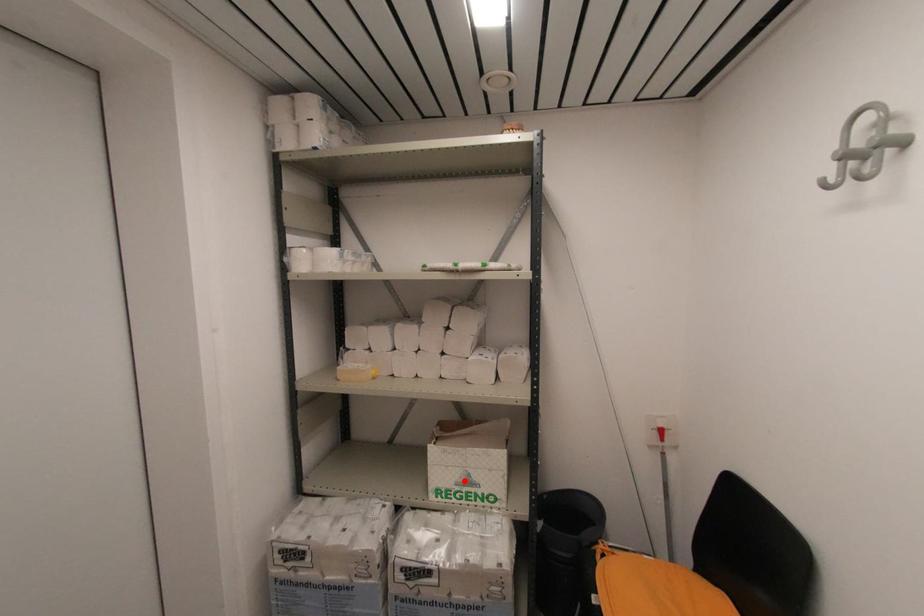
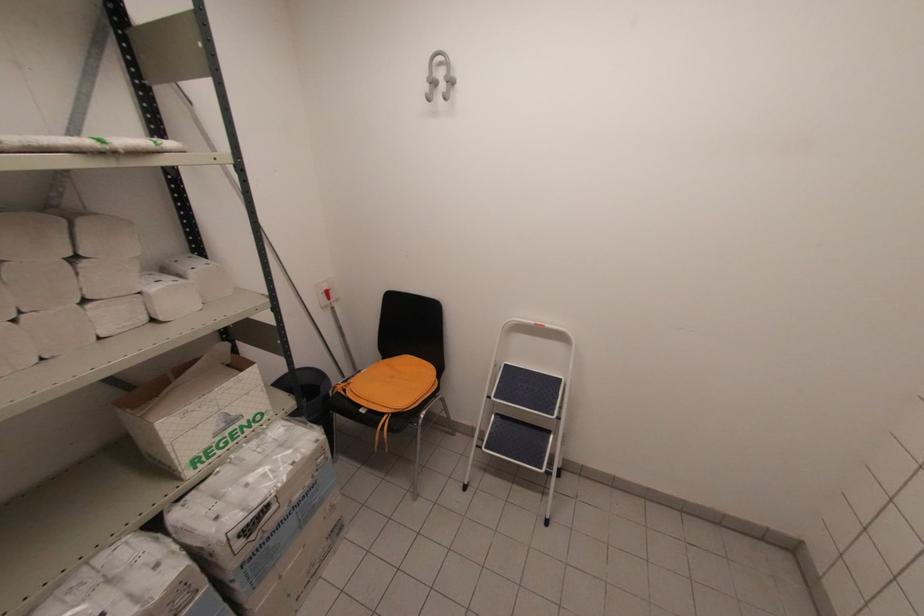
Question: I am providing you with two images of the same scene from different viewpoints. Image1 has a red point marked. In image2, the corresponding 3D location appears at what relative position? Reply with the corresponding letter.

Choices:
 (A) Closer
 (B) Farther

Answer: (A)